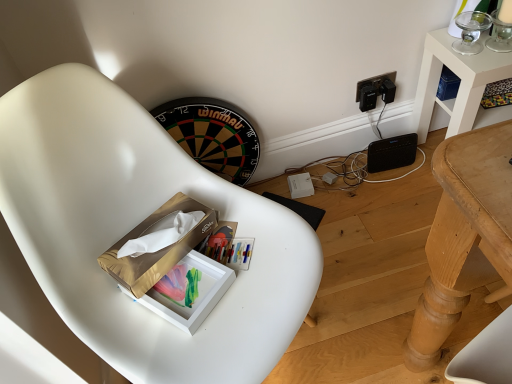
Question: Is gold cardboard box at center wider than white matte chair at center?

Choices:
 (A) yes
 (B) no

Answer: (B)

Question: Is gold cardboard box at center thinner than white matte chair at center?

Choices:
 (A) yes
 (B) no

Answer: (A)

Question: Does gold cardboard box at center have a larger size compared to white matte chair at center?

Choices:
 (A) no
 (B) yes

Answer: (A)

Question: Is gold cardboard box at center positioned before white matte chair at center?

Choices:
 (A) no
 (B) yes

Answer: (A)

Question: From a real-world perspective, is gold cardboard box at center on top of white matte chair at center?

Choices:
 (A) yes
 (B) no

Answer: (A)

Question: In terms of width, does matte gold tissue box at center look wider or thinner when compared to white matte chair at center?

Choices:
 (A) thin
 (B) wide

Answer: (A)

Question: Is matte gold tissue box at center in front of or behind white matte chair at center in the image?

Choices:
 (A) behind
 (B) front

Answer: (A)

Question: Considering the positions of matte gold tissue box at center and white matte chair at center in the image, is matte gold tissue box at center bigger or smaller than white matte chair at center?

Choices:
 (A) small
 (B) big

Answer: (A)

Question: Is point (177, 273) positioned closer to the camera than point (106, 109)?

Choices:
 (A) closer
 (B) farther

Answer: (B)

Question: Based on their positions, is white matte chair at center located to the left or right of matte gold tissue box at center?

Choices:
 (A) left
 (B) right

Answer: (B)

Question: Considering the positions of white matte chair at center and matte gold tissue box at center in the image, is white matte chair at center wider or thinner than matte gold tissue box at center?

Choices:
 (A) wide
 (B) thin

Answer: (A)

Question: Is point (283, 296) positioned closer to the camera than point (221, 296)?

Choices:
 (A) closer
 (B) farther

Answer: (A)

Question: From a real-world perspective, relative to matte gold tissue box at center, is white matte chair at center vertically above or below?

Choices:
 (A) above
 (B) below

Answer: (B)

Question: From a real-world perspective, is gold cardboard box at center positioned above or below matte gold tissue box at center?

Choices:
 (A) above
 (B) below

Answer: (A)

Question: Would you say gold cardboard box at center is to the left or to the right of matte gold tissue box at center in the picture?

Choices:
 (A) left
 (B) right

Answer: (A)